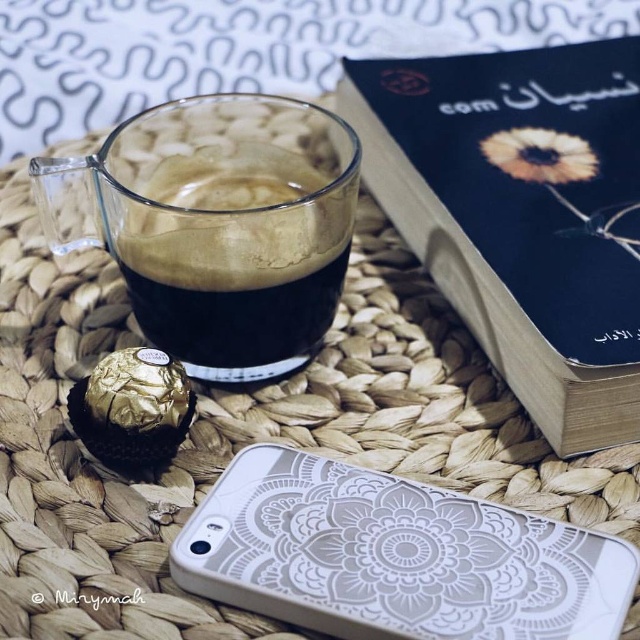
Can you confirm if matte black book at upper right is shorter than transparent glass cup at upper left?

No.

Consider the image. Is matte black book at upper right positioned at the back of transparent glass cup at upper left?

No.

The image size is (640, 640). Find the location of `matte black book at upper right`. matte black book at upper right is located at coordinates (522, 212).

Locate an element on the screen. This screenshot has height=640, width=640. matte black book at upper right is located at coordinates (522, 212).

Is point (413, 77) closer to viewer compared to point (410, 552)?

No, (413, 77) is behind (410, 552).

Does matte black book at upper right have a larger size compared to white textured phone case at lower center?

Correct, matte black book at upper right is larger in size than white textured phone case at lower center.

Is point (547, 58) closer to camera compared to point (218, 593)?

No.

The height and width of the screenshot is (640, 640). What are the coordinates of `matte black book at upper right` in the screenshot? It's located at (522, 212).

Which is below, transparent glass cup at upper left or white textured phone case at lower center?

white textured phone case at lower center

Find the location of a particular element. transparent glass cup at upper left is located at coordinates (218, 225).

Locate an element on the screen. transparent glass cup at upper left is located at coordinates (218, 225).